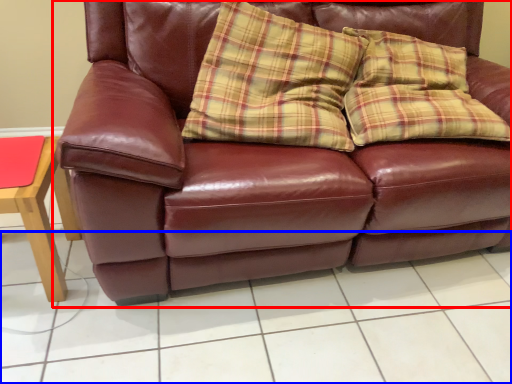
Question: Which of the following is the farthest to the observer, studio couch (highlighted by a red box) or tile (highlighted by a blue box)?

Choices:
 (A) studio couch
 (B) tile

Answer: (B)